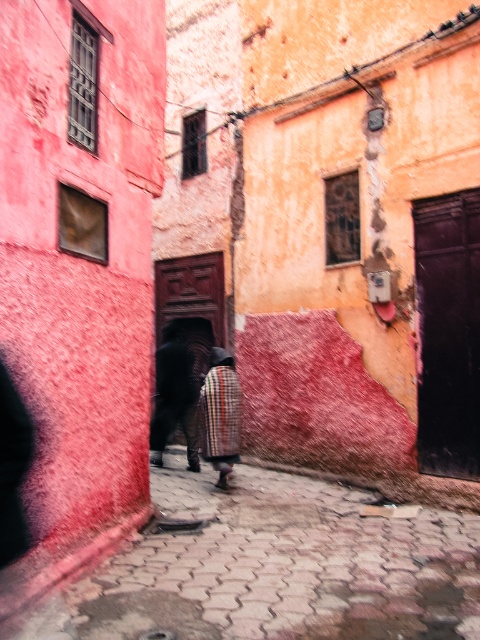
You are a delivery person standing at the entrance of the alley. You need to place a package between the dark brown leather pants at center and the plaid fabric coat at center. The package is 4 feet long. Can you fit it between them?

The dark brown leather pants at center is 3.92 feet from the plaid fabric coat at center, so the package is 4 feet long which is slightly longer than the distance between them. Therefore, the package cannot be placed between them.